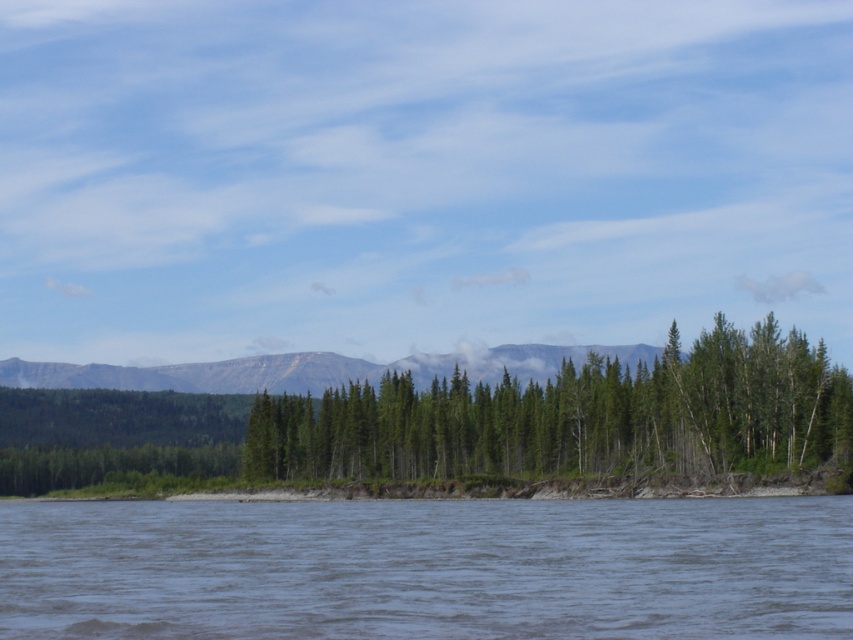
Consider the image. You are standing at the edge of the water in the serene landscape and notice two points marked in the image. Which of the two points, point (805, 616) or point (608, 458), is closer to your current position?

Point (805, 616) is closer to the camera than point (608, 458), so it is closer to your current position.